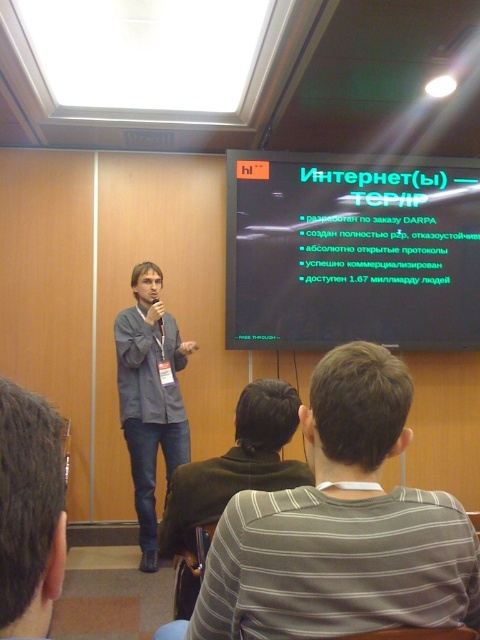
Does gray striped shirt at lower right appear over dark brown hair at upper center?

Incorrect, gray striped shirt at lower right is not positioned above dark brown hair at upper center.

Can you confirm if gray striped shirt at lower right is positioned below dark brown hair at upper center?

Yes.

The width and height of the screenshot is (480, 640). In order to click on gray striped shirt at lower right in this screenshot , I will do point(342,525).

Does gray striped shirt at lower right lie in front of denim jeans at center?

→ That is True.

Which is below, gray striped shirt at lower right or denim jeans at center?

Positioned lower is denim jeans at center.

You are a GUI agent. You are given a task and a screenshot of the screen. Output one action in this format:
    pyautogui.click(x=<x>, y=<y>)
    Task: Click on the gray striped shirt at lower right
    This screenshot has height=640, width=480.
    Given the screenshot: What is the action you would take?
    [x=342, y=525]

What do you see at coordinates (29, 512) in the screenshot? I see `dark brown hair at upper center` at bounding box center [29, 512].

Does dark brown hair at upper center lie behind denim jeans at center?

No, it is in front of denim jeans at center.

What are the coordinates of `dark brown hair at upper center` in the screenshot? It's located at coord(29,512).